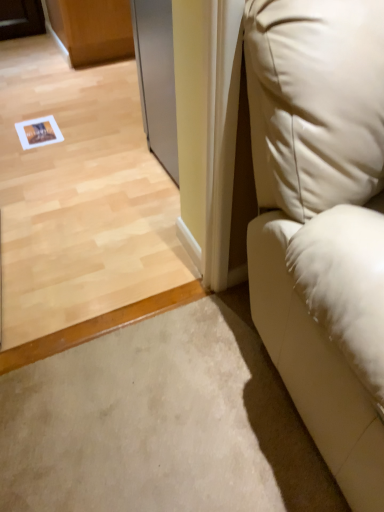
Question: Does silver metallic screen door at upper center come behind white leather couch at right?

Choices:
 (A) yes
 (B) no

Answer: (A)

Question: Does silver metallic screen door at upper center have a smaller size compared to white leather couch at right?

Choices:
 (A) no
 (B) yes

Answer: (B)

Question: Can you confirm if silver metallic screen door at upper center is positioned to the right of white leather couch at right?

Choices:
 (A) yes
 (B) no

Answer: (B)

Question: Can you confirm if silver metallic screen door at upper center is thinner than white leather couch at right?

Choices:
 (A) yes
 (B) no

Answer: (A)

Question: Is silver metallic screen door at upper center directly adjacent to white leather couch at right?

Choices:
 (A) no
 (B) yes

Answer: (A)

Question: Does silver metallic screen door at upper center have a greater width compared to white leather couch at right?

Choices:
 (A) yes
 (B) no

Answer: (B)

Question: Is silver metallic screen door at upper center located within white leather couch at right?

Choices:
 (A) yes
 (B) no

Answer: (B)

Question: From a real-world perspective, is white leather couch at right under silver metallic screen door at upper center?

Choices:
 (A) yes
 (B) no

Answer: (B)

Question: Is white leather couch at right to the right of silver metallic screen door at upper center from the viewer's perspective?

Choices:
 (A) no
 (B) yes

Answer: (B)

Question: Is white leather couch at right in contact with silver metallic screen door at upper center?

Choices:
 (A) yes
 (B) no

Answer: (B)

Question: Considering the relative sizes of white leather couch at right and silver metallic screen door at upper center in the image provided, is white leather couch at right shorter than silver metallic screen door at upper center?

Choices:
 (A) yes
 (B) no

Answer: (B)

Question: Does white leather couch at right have a smaller size compared to silver metallic screen door at upper center?

Choices:
 (A) no
 (B) yes

Answer: (A)

Question: Looking at their shapes, would you say silver metallic screen door at upper center is wider or thinner than white leather couch at right?

Choices:
 (A) thin
 (B) wide

Answer: (A)